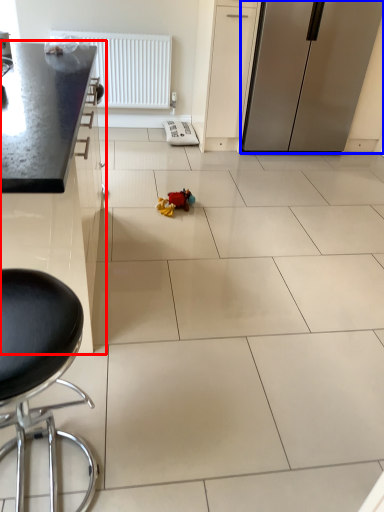
Question: Which object is further to the camera taking this photo, cabinetry (highlighted by a red box) or refrigerator (highlighted by a blue box)?

Choices:
 (A) cabinetry
 (B) refrigerator

Answer: (B)